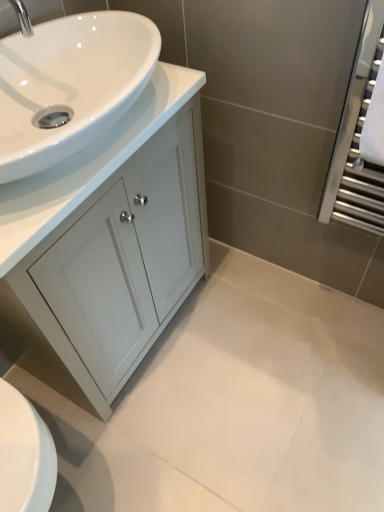
Question: Which is correct: silver metallic tap at upper left is inside white glossy cabinet at left, or outside of it?

Choices:
 (A) outside
 (B) inside

Answer: (A)

Question: In terms of height, does silver metallic tap at upper left look taller or shorter compared to white glossy cabinet at left?

Choices:
 (A) tall
 (B) short

Answer: (B)

Question: Estimate the real-world distances between objects in this image. Which object is closer to the white glossy sink at upper left?

Choices:
 (A) silver metallic tap at upper left
 (B) white glossy cabinet at left

Answer: (A)

Question: Which object is positioned closest to the white glossy sink at upper left?

Choices:
 (A) silver metallic tap at upper left
 (B) white glossy cabinet at left

Answer: (A)